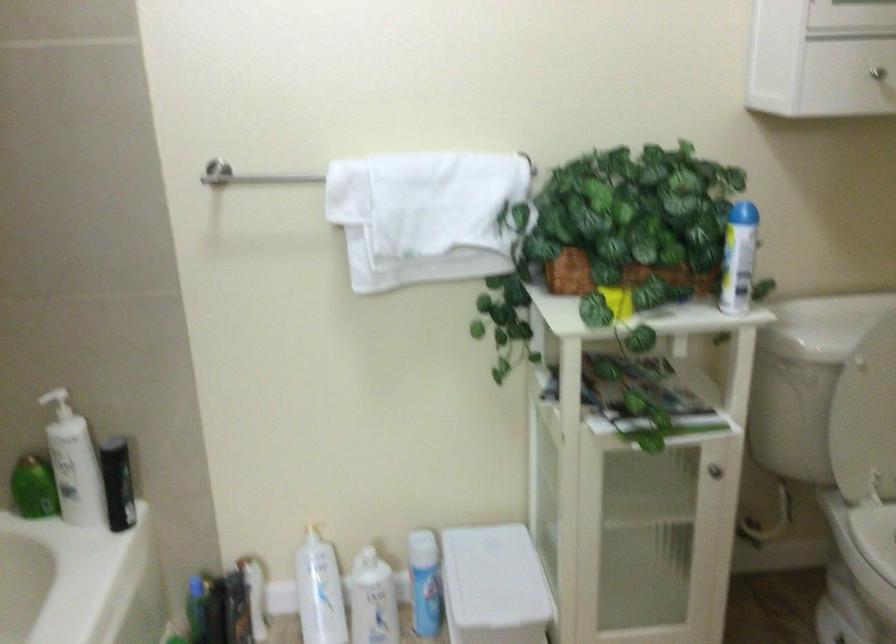
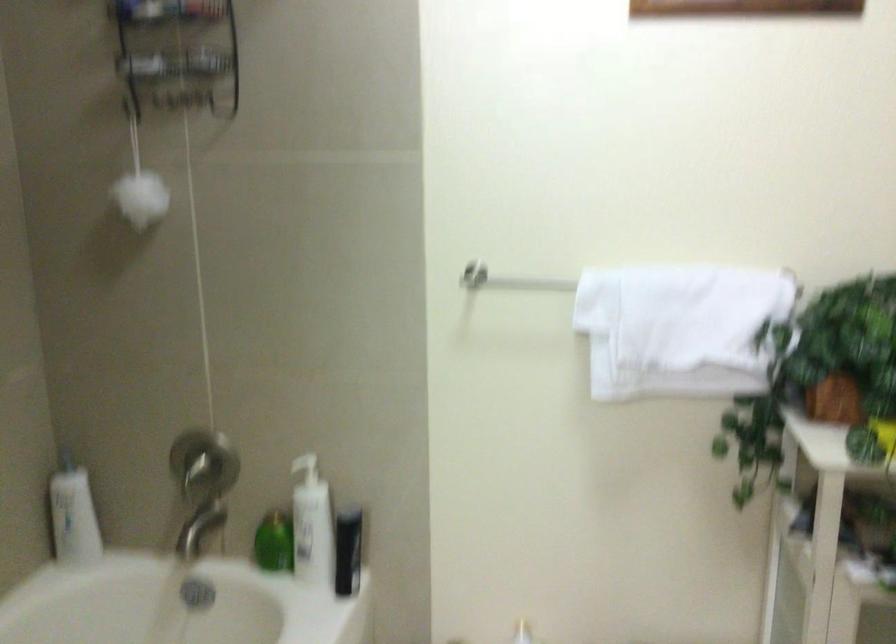
Question: The camera is either moving clockwise (left) or counter-clockwise (right) around the object. The first image is from the beginning of the video and the second image is from the end. Is the camera moving left or right when shooting the video?

Choices:
 (A) Left
 (B) Right

Answer: (B)